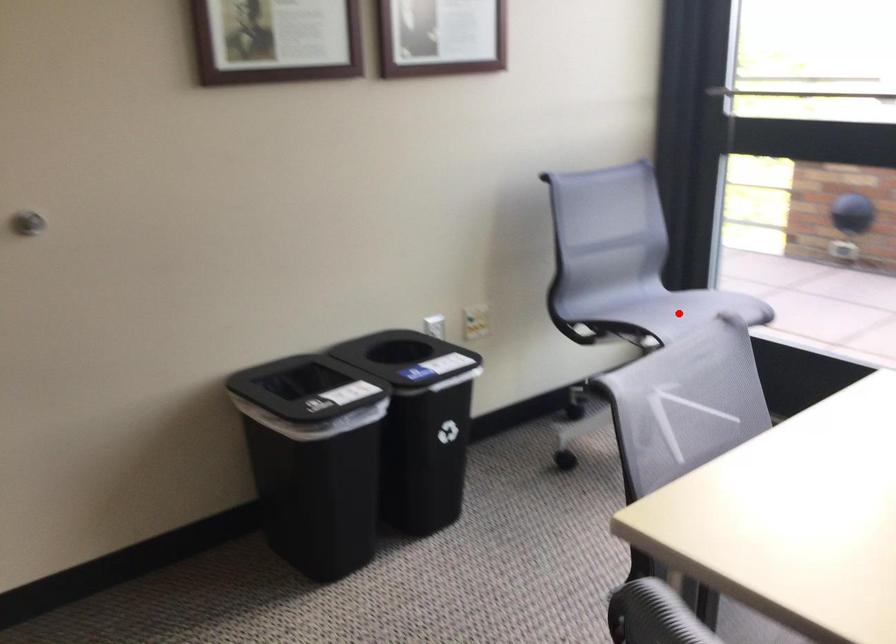
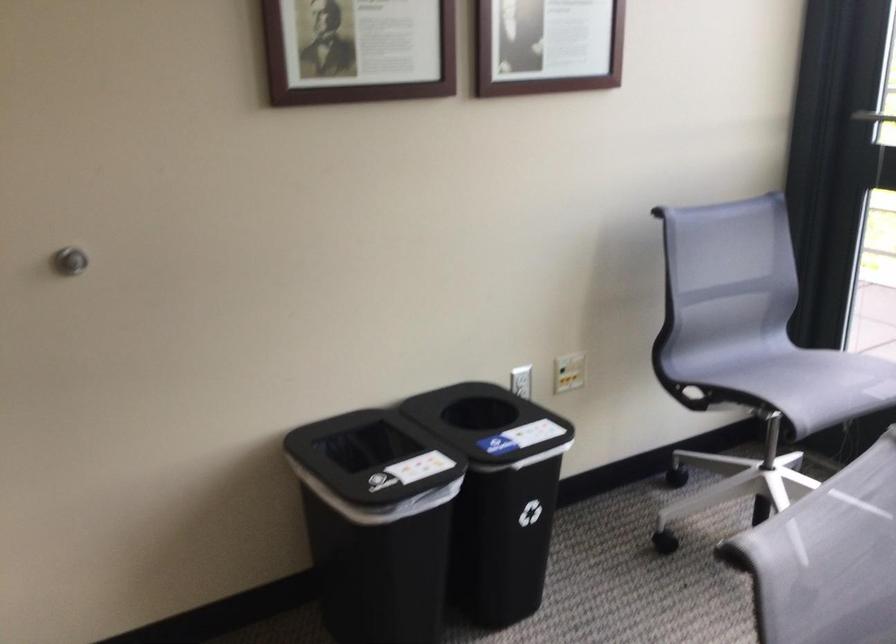
Question: A red point is marked in image1. In image2, is the corresponding 3D point closer to the camera or farther? Reply with the corresponding letter.

Choices:
 (A) The corresponding 3D point is closer.
 (B) The corresponding 3D point is farther.

Answer: (A)